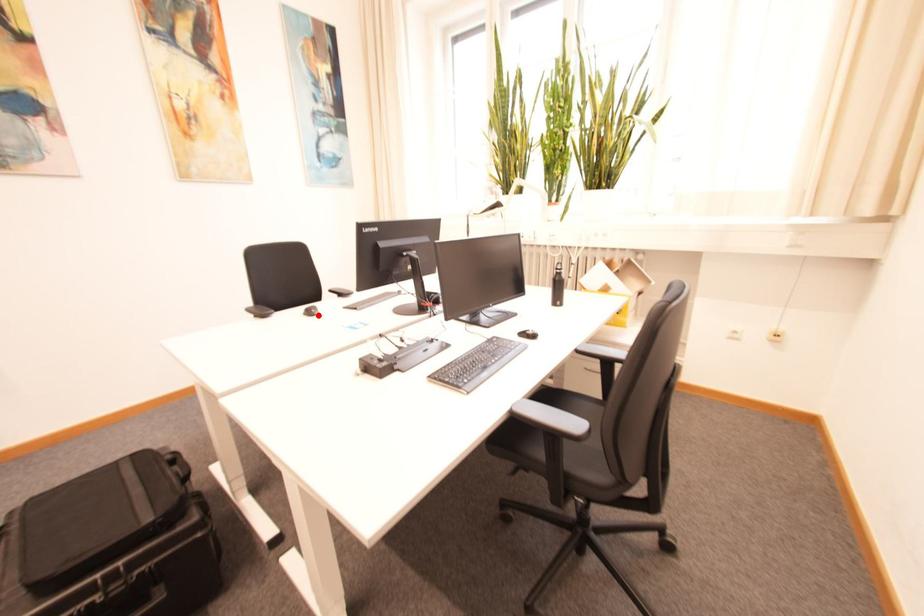
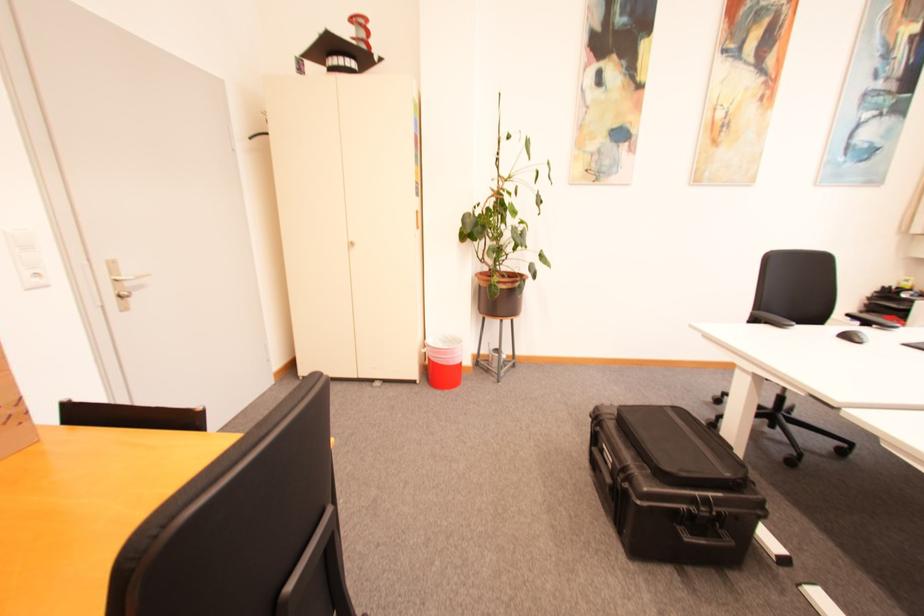
Find the pixel in the second image that matches the highlighted location in the first image.

(865, 342)